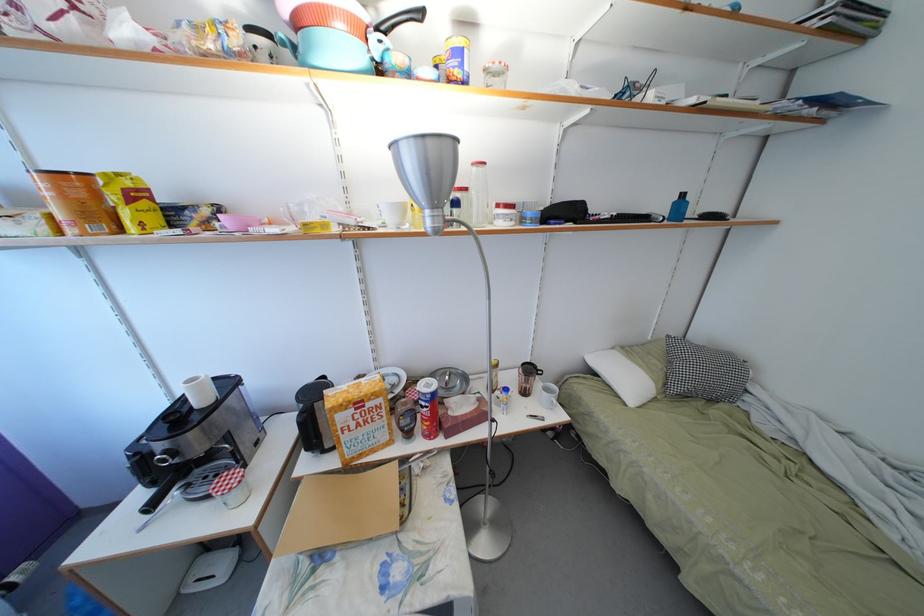
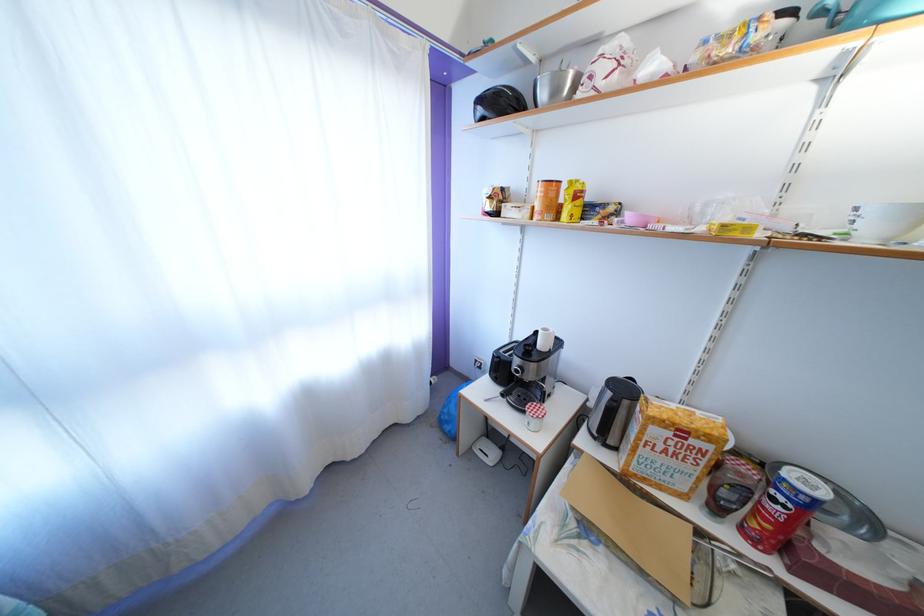
Find the pixel in the second image that matches (x=429, y=408) in the first image.

(786, 505)